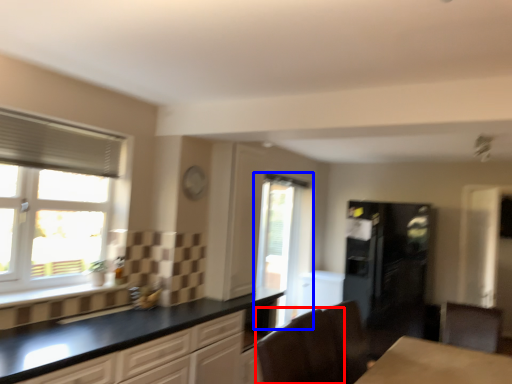
Question: Which object appears closest to the camera in this image, armchair (highlighted by a red box) or window (highlighted by a blue box)?

Choices:
 (A) armchair
 (B) window

Answer: (A)